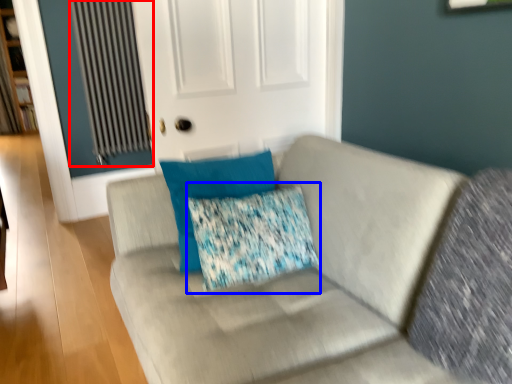
Question: Which object appears closest to the camera in this image, radiator (highlighted by a red box) or throw pillow (highlighted by a blue box)?

Choices:
 (A) radiator
 (B) throw pillow

Answer: (B)